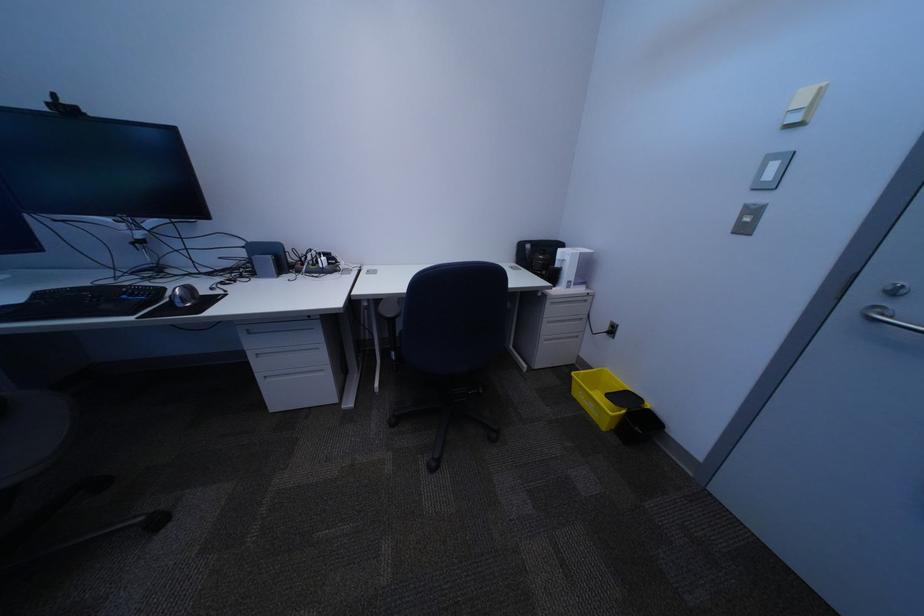
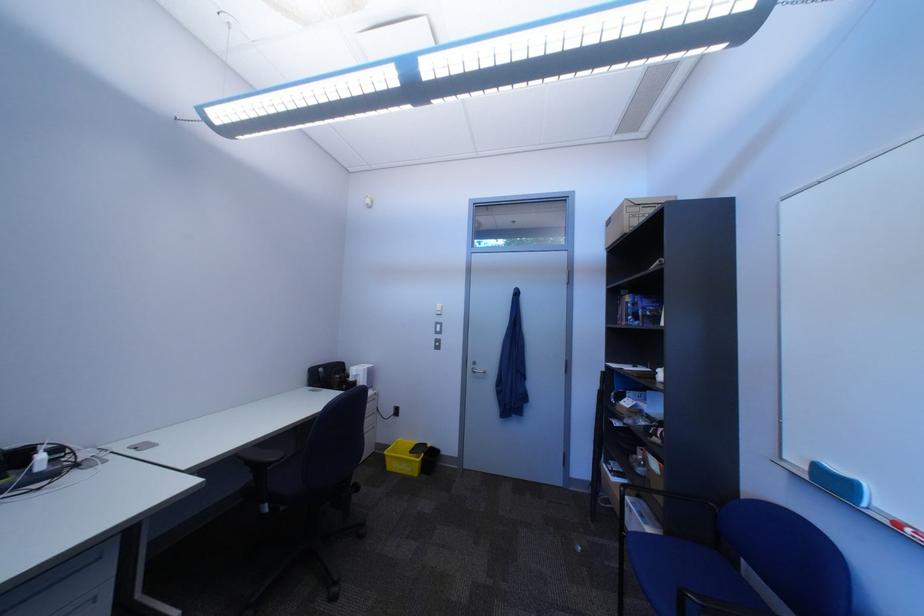
Locate, in the second image, the point that corresponds to point 589,367 in the first image.

(388, 454)